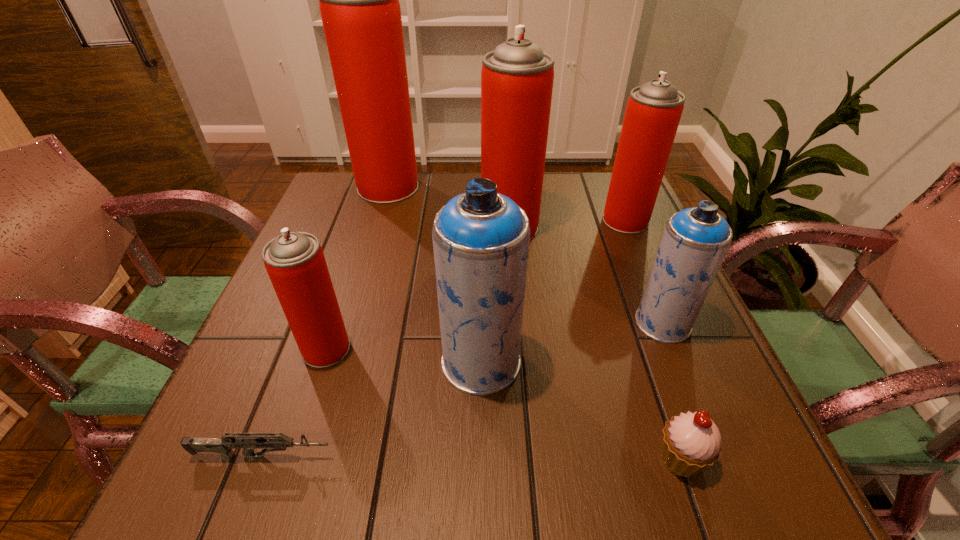
Identify the location of grey gun. This screenshot has height=540, width=960. (223, 445).

This screenshot has height=540, width=960. Identify the location of vacant space situated on the right of the farthest red aerosol can. (508, 187).

Locate an element on the screen. The image size is (960, 540). free space located on the left of the second biggest red aerosol can is located at coordinates (412, 227).

Identify the location of free location located 0.370m on the left of the third biggest red aerosol can. The width and height of the screenshot is (960, 540). (457, 220).

At what (x,y) coordinates should I click in order to perform the action: click on vacant point located 0.090m on the left of the left blue aerosol can. Please return your answer as a coordinate pair (x, y). Image resolution: width=960 pixels, height=540 pixels. Looking at the image, I should click on (392, 362).

Locate an element on the screen. The image size is (960, 540). vacant space located on the back of the smallest red aerosol can is located at coordinates (340, 309).

Locate an element on the screen. free point located 0.340m on the left of the right blue aerosol can is located at coordinates (461, 323).

You are a GUI agent. You are given a task and a screenshot of the screen. Output one action in this format:
    pyautogui.click(x=<x>, y=<y>)
    Task: Click on the free region located on the back of the cupcake
    The height and width of the screenshot is (540, 960).
    Given the screenshot: What is the action you would take?
    pyautogui.click(x=652, y=375)

Locate an element on the screen. vacant area located aimed along the barrel of the shortest object is located at coordinates (533, 456).

You are a GUI agent. You are given a task and a screenshot of the screen. Output one action in this format:
    pyautogui.click(x=<x>, y=<y>)
    Task: Click on the cupcake at the near edge
    
    Given the screenshot: What is the action you would take?
    click(x=691, y=442)